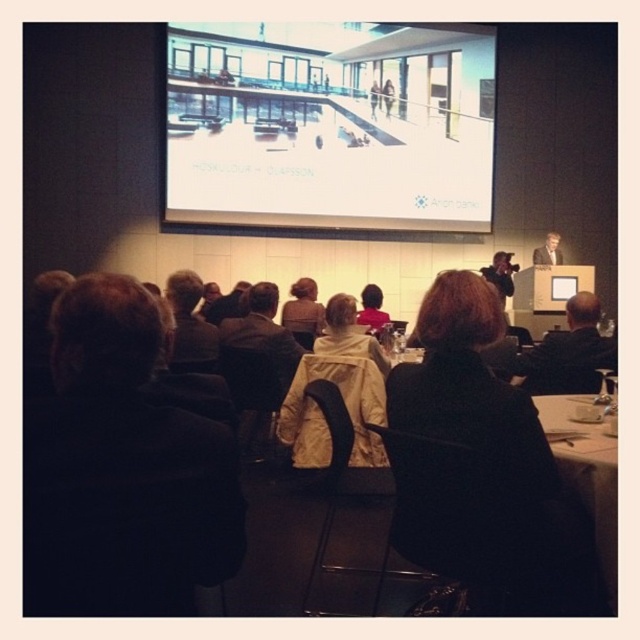
Does light beige jacket at center have a smaller size compared to smooth skin face at upper right?

Actually, light beige jacket at center might be larger than smooth skin face at upper right.

Does point (348, 369) come farther from viewer compared to point (538, 252)?

No.

Which is behind, point (330, 333) or point (541, 259)?

The point (541, 259) is more distant.

You are a GUI agent. You are given a task and a screenshot of the screen. Output one action in this format:
    pyautogui.click(x=<x>, y=<y>)
    Task: Click on the light beige jacket at center
    
    Given the screenshot: What is the action you would take?
    pyautogui.click(x=339, y=392)

Is pink fabric at center wider than smooth skin face at upper right?

In fact, pink fabric at center might be narrower than smooth skin face at upper right.

Is pink fabric at center smaller than smooth skin face at upper right?

Correct, pink fabric at center occupies less space than smooth skin face at upper right.

Identify the location of pink fabric at center. This screenshot has width=640, height=640. (371, 308).

The height and width of the screenshot is (640, 640). I want to click on pink fabric at center, so click(x=371, y=308).

Which is below, light beige jacket at center or brown fabric jacket at center?

light beige jacket at center

Does light beige jacket at center have a lesser height compared to brown fabric jacket at center?

No.

Locate an element on the screen. Image resolution: width=640 pixels, height=640 pixels. light beige jacket at center is located at coordinates (339, 392).

Find the location of `light beige jacket at center`. light beige jacket at center is located at coordinates (339, 392).